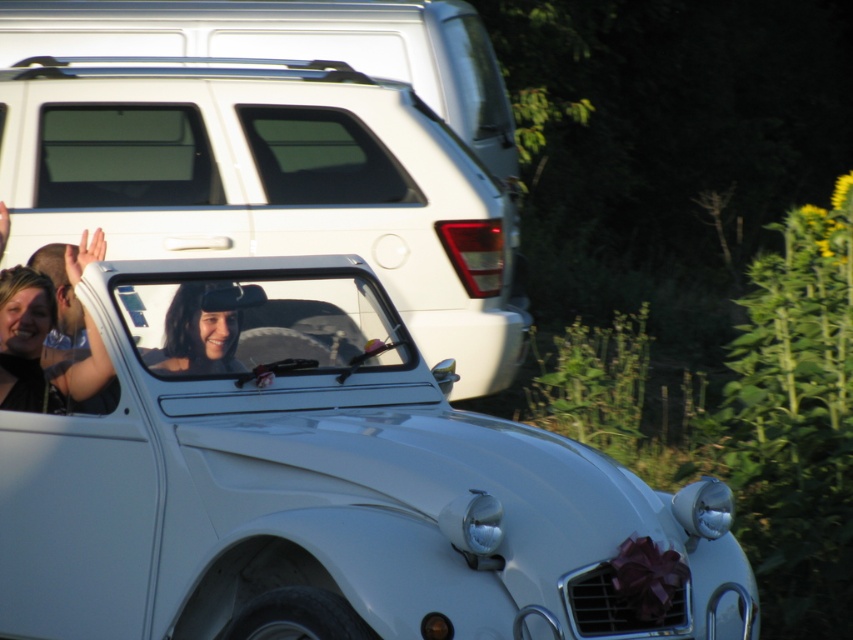
Question: Estimate the real-world distances between objects in this image. Which object is closer to the white glossy car at center?

Choices:
 (A) white matte suv at upper left
 (B) matte black hair at upper left
 (C) matte black hat at center

Answer: (C)

Question: Which is farther from the white matte suv at upper left?

Choices:
 (A) matte black hair at upper left
 (B) white glossy car at center
 (C) matte black hat at center

Answer: (B)

Question: Observing the image, what is the correct spatial positioning of white matte suv at upper left in reference to matte black hat at center?

Choices:
 (A) above
 (B) below

Answer: (A)

Question: Does white glossy car at center have a smaller size compared to matte black hair at upper left?

Choices:
 (A) no
 (B) yes

Answer: (A)

Question: Which point is closer to the camera?

Choices:
 (A) matte black hair at upper left
 (B) matte black hat at center
 (C) white matte suv at upper left
 (D) white glossy car at center

Answer: (D)

Question: Can you confirm if white glossy car at center is thinner than white matte suv at upper left?

Choices:
 (A) yes
 (B) no

Answer: (A)